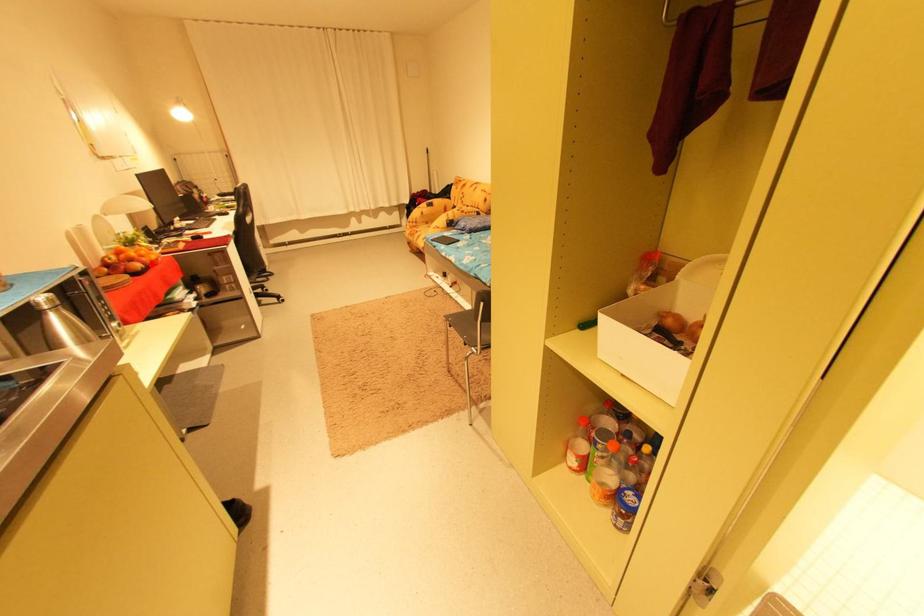
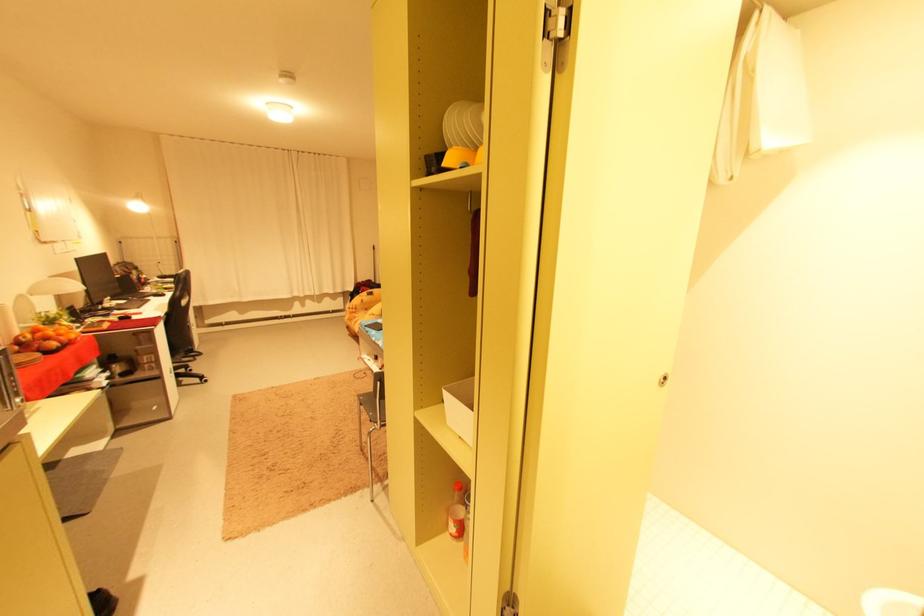
Find the pixel in the second image that matches the highlighted location in the first image.

(68, 344)